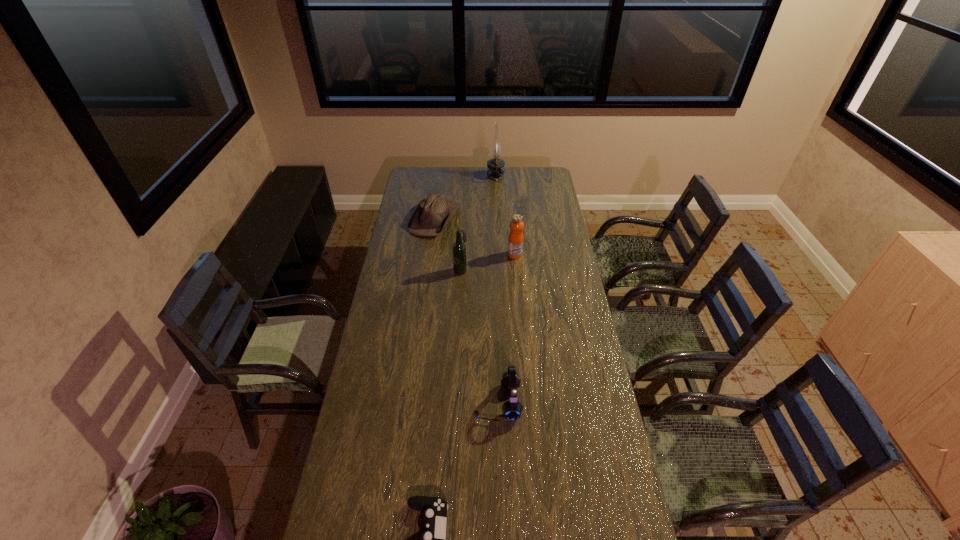
I want to click on blank space located 0.170m on the left of the fruit juice, so click(x=473, y=255).

Locate an element on the screen. This screenshot has width=960, height=540. free space located on the ear cushions of the third shortest object is located at coordinates (417, 402).

This screenshot has width=960, height=540. Find the location of `free space located 0.300m on the ear cushions of the third shortest object`. free space located 0.300m on the ear cushions of the third shortest object is located at coordinates (x=392, y=402).

The image size is (960, 540). Find the location of `vacant space located 0.090m on the ear cushions of the third shortest object`. vacant space located 0.090m on the ear cushions of the third shortest object is located at coordinates (450, 402).

This screenshot has height=540, width=960. Identify the location of vacant point located 0.340m on the front of the second shortest object. (427, 285).

The height and width of the screenshot is (540, 960). Find the location of `object located in the far edge section of the desktop`. object located in the far edge section of the desktop is located at coordinates (495, 170).

At what (x,y) coordinates should I click in order to perform the action: click on object that is at the left edge. Please return your answer as a coordinate pair (x, y). Looking at the image, I should click on (432, 215).

This screenshot has height=540, width=960. In the image, there is a desktop. What are the coordinates of `vacant space at the far edge` in the screenshot? It's located at (460, 178).

Where is `vacant space at the left edge of the desktop`? This screenshot has width=960, height=540. vacant space at the left edge of the desktop is located at coordinates (390, 265).

The width and height of the screenshot is (960, 540). In the image, there is a desktop. In order to click on vacant area at the right edge in this screenshot , I will do `click(552, 309)`.